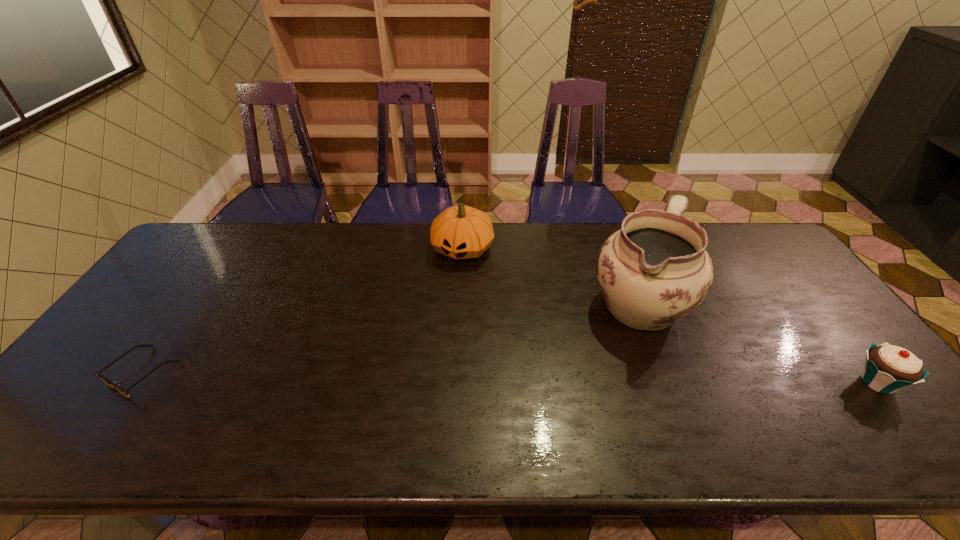
Where is `object that is positioned at the near left corner`? object that is positioned at the near left corner is located at coordinates (109, 382).

I want to click on object that is at the near right corner, so click(888, 368).

Where is `free space at the far edge of the desktop`? free space at the far edge of the desktop is located at coordinates (305, 253).

You are a GUI agent. You are given a task and a screenshot of the screen. Output one action in this format:
    pyautogui.click(x=<x>, y=<y>)
    Task: Click on the free space at the near edge
    The image size is (960, 540).
    Given the screenshot: What is the action you would take?
    [x=574, y=397]

You are a GUI agent. You are given a task and a screenshot of the screen. Output one action in this format:
    pyautogui.click(x=<x>, y=<y>)
    Task: Click on the vacant space at the left edge of the desktop
    This screenshot has width=960, height=540.
    Given the screenshot: What is the action you would take?
    pyautogui.click(x=174, y=274)

In the image, there is a desktop. In order to click on free space at the far right corner in this screenshot , I will do `click(741, 238)`.

At what (x,y) coordinates should I click in order to perform the action: click on free spot at the near right corner of the desktop. Please return your answer as a coordinate pair (x, y). The width and height of the screenshot is (960, 540). Looking at the image, I should click on (917, 414).

You are a GUI agent. You are given a task and a screenshot of the screen. Output one action in this format:
    pyautogui.click(x=<x>, y=<y>)
    Task: Click on the vacant area that lies between the third tallest object and the sunglasses
    This screenshot has height=540, width=960.
    Given the screenshot: What is the action you would take?
    pyautogui.click(x=510, y=377)

This screenshot has height=540, width=960. I want to click on vacant region between the rightmost object and the shortest object, so click(510, 377).

Where is `free space that is in between the leftmost object and the second object from right to left`? free space that is in between the leftmost object and the second object from right to left is located at coordinates (391, 338).